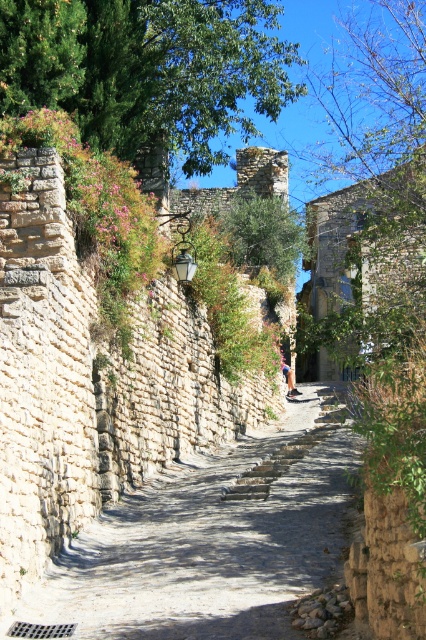
You are a tourist walking along the cobblestone street and want to take a photo of the green leafy tree at upper left. To get the best shot, should you move towards the smooth stone path at center or away from it?

The smooth stone path at center is closer to the viewer than the green leafy tree at upper left. To get a better shot of the green leafy tree at upper left, you should move away from the smooth stone path at center so that the tree becomes more centered in your view.

You are a tourist walking along the smooth stone path at center in the narrow cobblestone street. You want to take a photo of the green leafy tree at upper left. Which direction should you move to get the tree in your camera frame?

The smooth stone path at center is shorter than the green leafy tree at upper left, so you should move closer to the green leafy tree at upper left to get it in your camera frame.